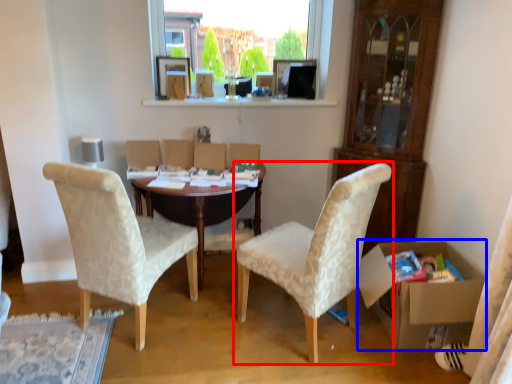
Question: Which of the following is the farthest to the observer, chair (highlighted by a red box) or box (highlighted by a blue box)?

Choices:
 (A) chair
 (B) box

Answer: (B)